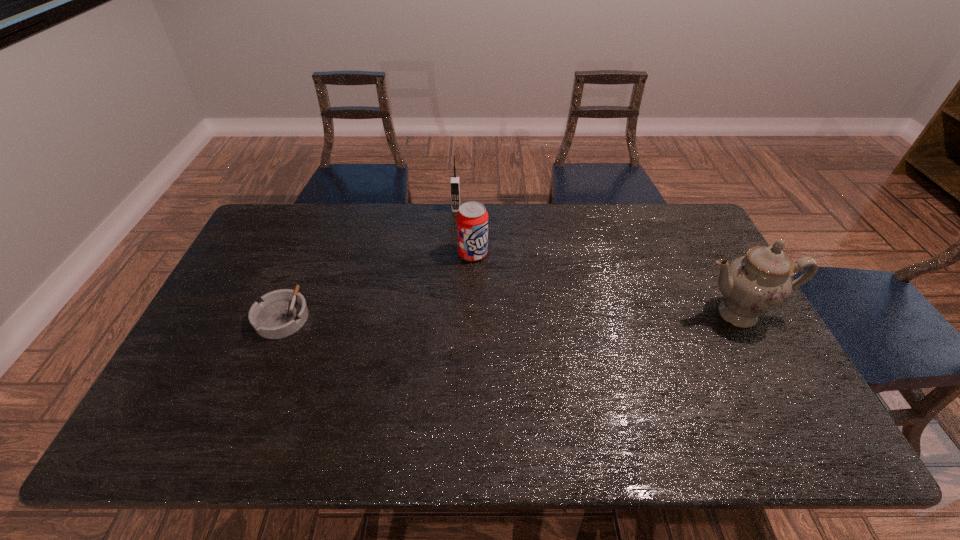
The width and height of the screenshot is (960, 540). I want to click on free space between the second object from right to left and the shortest object, so click(378, 285).

This screenshot has width=960, height=540. Find the location of `free space between the chinaware and the ashtray`. free space between the chinaware and the ashtray is located at coordinates (510, 315).

This screenshot has height=540, width=960. In order to click on free point between the farthest object and the chinaware in this screenshot , I will do `click(596, 261)`.

Where is `object that is the closest to the ashtray`? This screenshot has width=960, height=540. object that is the closest to the ashtray is located at coordinates (472, 218).

I want to click on object that stands as the second closest to the chinaware, so click(455, 181).

Identify the location of free spot that satisfies the following two spatial constraints: 1. on the front side of the third tallest object; 2. on the left side of the second object from left to right. (453, 254).